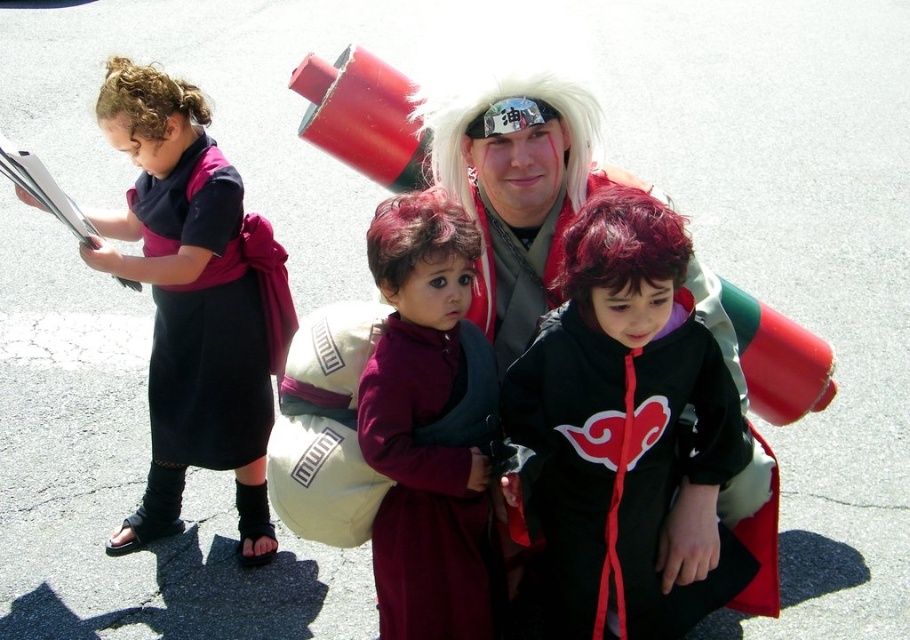
Question: Which point is farther to the camera?

Choices:
 (A) dark red curly wig at center
 (B) matte black hoodie at center
 (C) shiny red wig at center

Answer: (B)

Question: Is black matte dress at left closer to the viewer compared to shiny red wig at center?

Choices:
 (A) no
 (B) yes

Answer: (A)

Question: Based on their relative distances, which object is nearer to the dark red curly wig at center?

Choices:
 (A) matte black hoodie at center
 (B) velvet maroon robe at center

Answer: (B)

Question: Observing the image, what is the correct spatial positioning of dark red curly wig at center in reference to curly hair at upper left?

Choices:
 (A) left
 (B) right

Answer: (B)

Question: Estimate the real-world distances between objects in this image. Which object is closer to the curly hair at upper left?

Choices:
 (A) matte black hoodie at center
 (B) shiny red wig at center

Answer: (A)

Question: Is black matte hoodie at center bigger than shiny red wig at center?

Choices:
 (A) yes
 (B) no

Answer: (A)